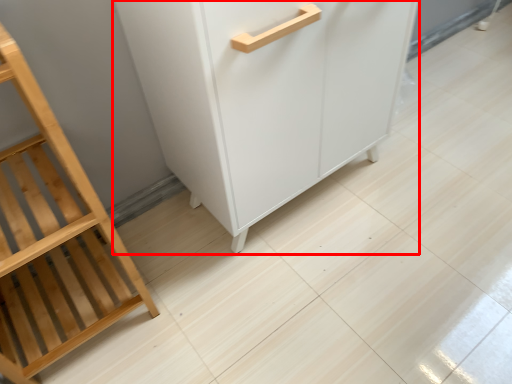
Question: From the image's perspective, where is cupboard (annotated by the red box) located in relation to furniture in the image?

Choices:
 (A) below
 (B) above

Answer: (B)